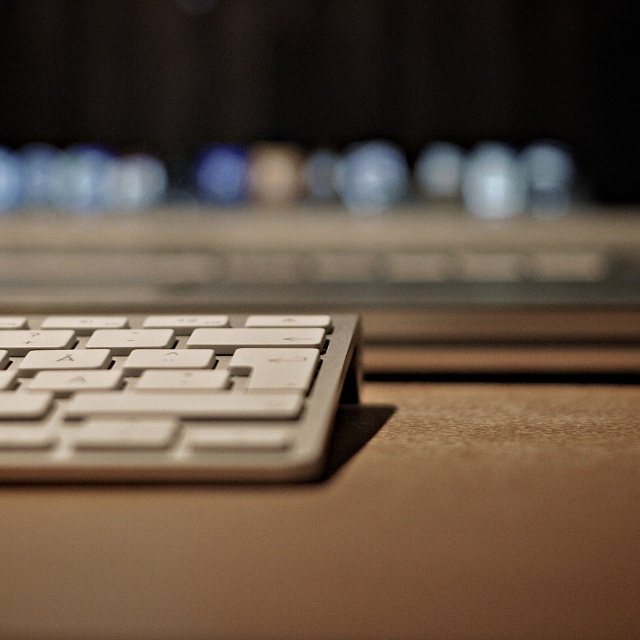
Which is above, white matte computer desk at lower center or white plastic keyboard at lower left?

white plastic keyboard at lower left is above.

The width and height of the screenshot is (640, 640). In order to click on white matte computer desk at lower center in this screenshot , I will do [x=358, y=531].